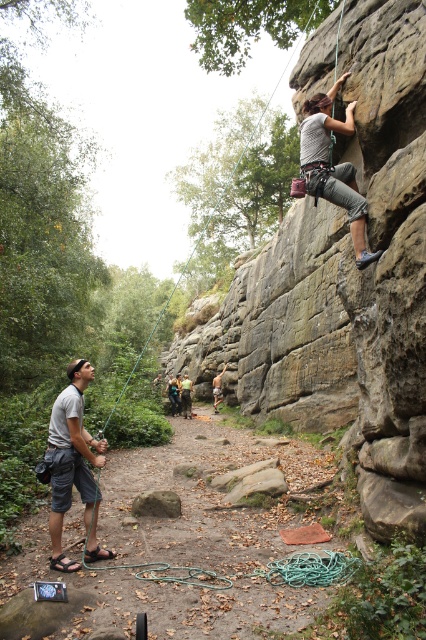
Question: Does gray fabric shirt at left have a smaller size compared to gray fabric shirt at upper center?

Choices:
 (A) yes
 (B) no

Answer: (A)

Question: Which point appears closest to the camera in this image?

Choices:
 (A) (163, 496)
 (B) (66, 428)
 (C) (377, 253)

Answer: (C)

Question: Among these points, which one is farthest from the camera?

Choices:
 (A) (65, 465)
 (B) (373, 257)
 (C) (173, 512)

Answer: (C)

Question: From the image, what is the correct spatial relationship of gray fabric shirt at left in relation to brown rough rock at center?

Choices:
 (A) below
 (B) above

Answer: (B)

Question: Is gray fabric shirt at left closer to camera compared to gray fabric shirt at upper center?

Choices:
 (A) no
 (B) yes

Answer: (A)

Question: Which is nearer to the brown rough rock at center?

Choices:
 (A) gray fabric shirt at upper center
 (B) gray fabric shirt at left

Answer: (B)